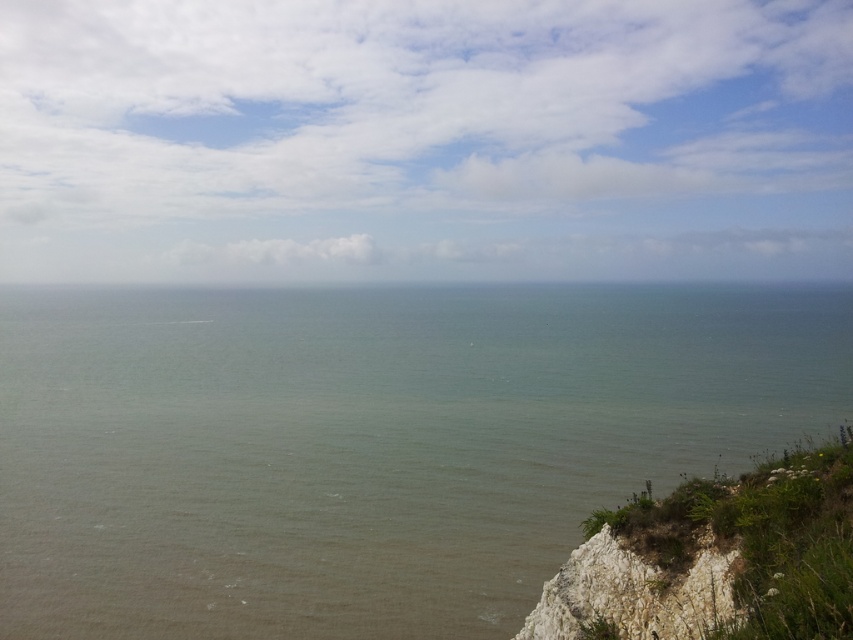
Question: Which point is closer to the camera?

Choices:
 (A) white rocky cliff at lower right
 (B) greenish-gray water at center

Answer: (A)

Question: Does greenish-gray water at center appear on the right side of white rocky cliff at lower right?

Choices:
 (A) no
 (B) yes

Answer: (A)

Question: Is greenish-gray water at center to the left of white rocky cliff at lower right from the viewer's perspective?

Choices:
 (A) yes
 (B) no

Answer: (A)

Question: Is greenish-gray water at center below white rocky cliff at lower right?

Choices:
 (A) no
 (B) yes

Answer: (A)

Question: Which point appears farthest from the camera in this image?

Choices:
 (A) (717, 608)
 (B) (120, 602)

Answer: (B)

Question: Which of the following is the farthest from the observer?

Choices:
 (A) greenish-gray water at center
 (B) white rocky cliff at lower right

Answer: (A)